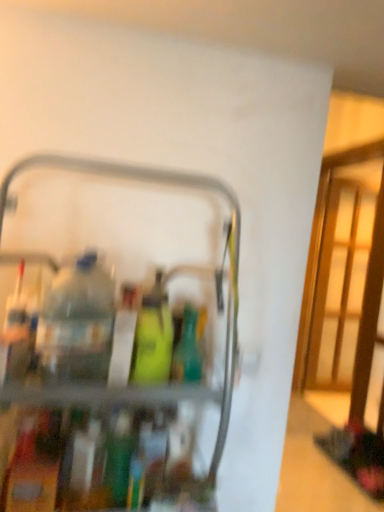
Question: In which direction should I rotate to look at green matte bottle at center, arranged as the third bottle when ordered from the bottom?

Choices:
 (A) right
 (B) left

Answer: (B)

Question: Considering the relative sizes of metallic gray cart at center and green matte bottle at center, placed as the 2th bottle when sorted from top to bottom, in the image provided, is metallic gray cart at center wider than green matte bottle at center, placed as the 2th bottle when sorted from top to bottom,?

Choices:
 (A) no
 (B) yes

Answer: (B)

Question: Are metallic gray cart at center and green matte bottle at center, placed as the 2th bottle when sorted from top to bottom, beside each other?

Choices:
 (A) yes
 (B) no

Answer: (B)

Question: From a real-world perspective, is metallic gray cart at center beneath green matte bottle at center, placed as the 2th bottle when sorted from top to bottom?

Choices:
 (A) yes
 (B) no

Answer: (A)

Question: Is metallic gray cart at center looking in the opposite direction of green matte bottle at center, positioned as the 2th bottle in bottom-to-top order?

Choices:
 (A) no
 (B) yes

Answer: (B)

Question: Is metallic gray cart at center taller than green matte bottle at center, placed as the 2th bottle when sorted from top to bottom?

Choices:
 (A) yes
 (B) no

Answer: (A)

Question: Would you say metallic gray cart at center contains green matte bottle at center, positioned as the 2th bottle in bottom-to-top order?

Choices:
 (A) yes
 (B) no

Answer: (A)

Question: From the image's perspective, is green matte bottle at center, which is the 1th bottle in top-to-bottom order, beneath green matte bottle at center, positioned as the 2th bottle in bottom-to-top order?

Choices:
 (A) no
 (B) yes

Answer: (A)

Question: Is green matte bottle at center, arranged as the third bottle when ordered from the bottom, facing towards green matte bottle at center, placed as the 2th bottle when sorted from top to bottom?

Choices:
 (A) yes
 (B) no

Answer: (B)

Question: Is green matte bottle at center, which is the 1th bottle in top-to-bottom order, further to camera compared to green matte bottle at center, positioned as the 2th bottle in bottom-to-top order?

Choices:
 (A) no
 (B) yes

Answer: (A)

Question: Is green matte bottle at center, arranged as the third bottle when ordered from the bottom, closer to the viewer compared to green matte bottle at center, placed as the 2th bottle when sorted from top to bottom?

Choices:
 (A) yes
 (B) no

Answer: (A)

Question: Is green matte bottle at center, arranged as the third bottle when ordered from the bottom, wider than green matte bottle at center, positioned as the 2th bottle in bottom-to-top order?

Choices:
 (A) no
 (B) yes

Answer: (B)

Question: Can we say green matte bottle at center, which is the 1th bottle in top-to-bottom order, lies outside green matte bottle at center, placed as the 2th bottle when sorted from top to bottom?

Choices:
 (A) yes
 (B) no

Answer: (A)

Question: From a real-world perspective, is green matte bottle at center, positioned as the 2th bottle in bottom-to-top order, physically above green matte bottle at center, arranged as the 1th bottle when ordered from the bottom?

Choices:
 (A) no
 (B) yes

Answer: (B)